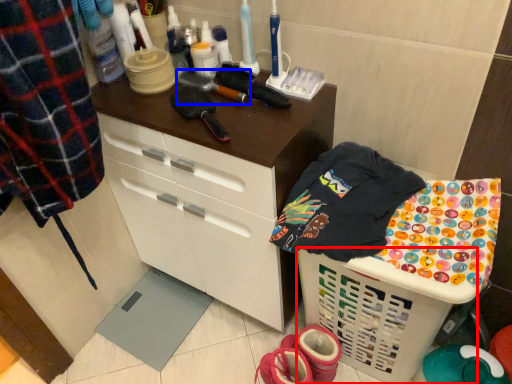
Question: Which point is further to the camera, basket (highlighted by a red box) or brush (highlighted by a blue box)?

Choices:
 (A) basket
 (B) brush

Answer: (B)